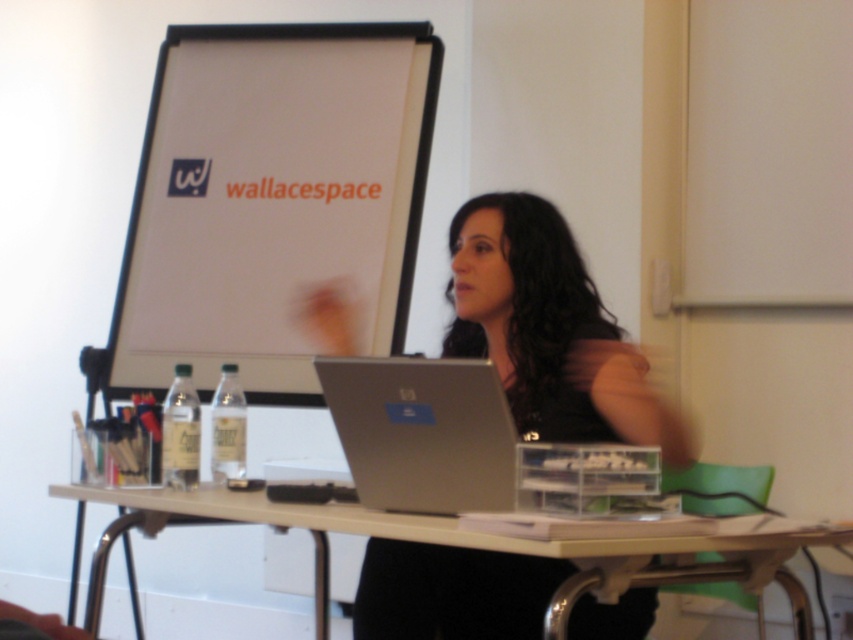
You are organizing a tech workshop and need to place both the matte black laptop at center and the silver metallic laptop at center on a desk. The desk has limited space, and you want to ensure the larger laptop is placed first. Which laptop should you place first?

The matte black laptop at center is bigger than the silver metallic laptop at center, so you should place the matte black laptop at center first to accommodate its size.

You are a student sitting in the front row of the classroom. You need to reach for the matte black laptop at center and the silver metallic laptop at center during the presentation. Which one can you grab without leaning over the table?

Result: The matte black laptop at center is closer to you than the silver metallic laptop at center, so you can grab it without leaning over the table.